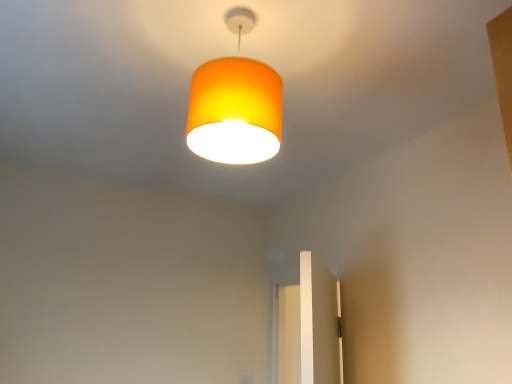
This screenshot has height=384, width=512. What do you see at coordinates (234, 111) in the screenshot? I see `orange fabric lampshade at upper center` at bounding box center [234, 111].

Where is `orange fabric lampshade at upper center`? The height and width of the screenshot is (384, 512). orange fabric lampshade at upper center is located at coordinates (234, 111).

The height and width of the screenshot is (384, 512). I want to click on orange fabric lampshade at upper center, so tap(234, 111).